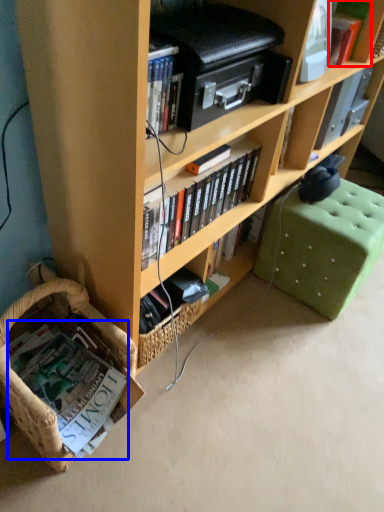
Question: Among these objects, which one is nearest to the camera, book (highlighted by a red box) or book (highlighted by a blue box)?

Choices:
 (A) book
 (B) book

Answer: (B)